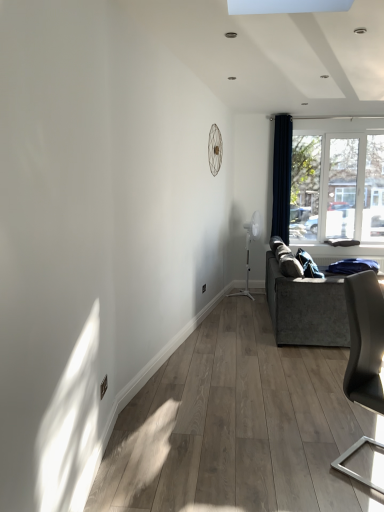
Locate an element on the screen. The width and height of the screenshot is (384, 512). vacant space underneath matte gray chair at right (from a real-world perspective) is located at coordinates (362, 460).